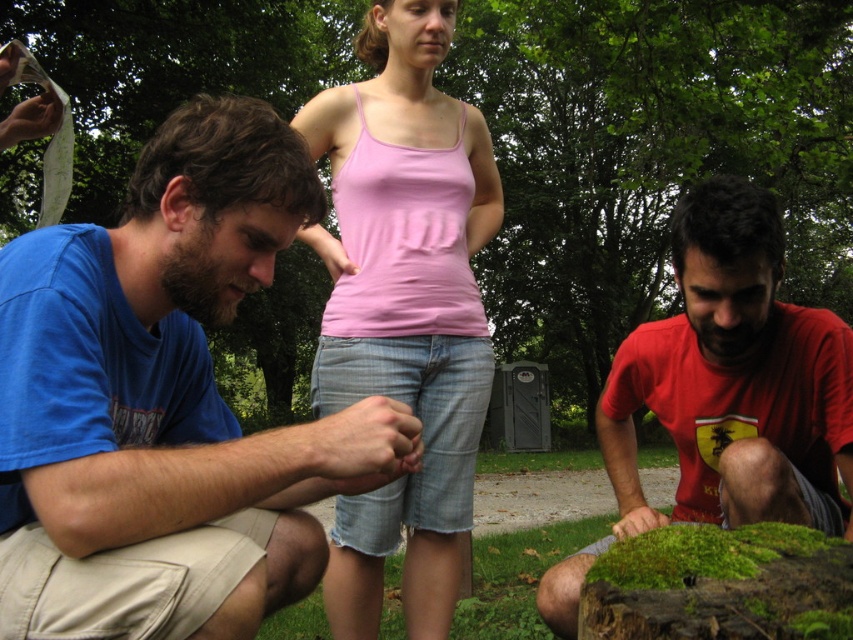
You are a photographer trying to capture a candid shot of the man in the blue cotton shirt at left. The camera is positioned at the center. What is the minimum distance you need to move the camera to get the man into frame?

The blue cotton shirt at left and camera are 33.61 inches apart, so you need to move the camera at least 33.61 inches closer to the man in the blue cotton shirt at left to get him into frame.